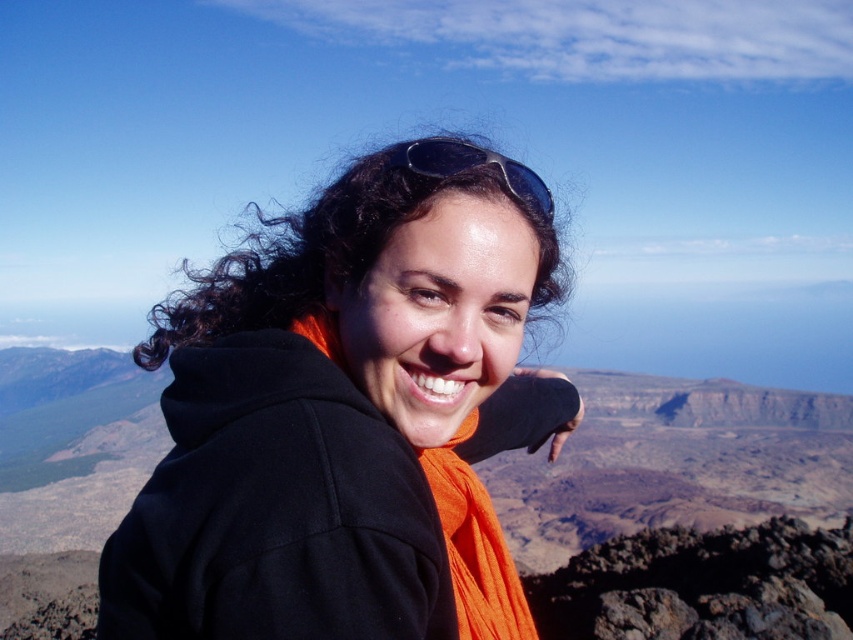
Question: Among these objects, which one is nearest to the camera?

Choices:
 (A) black fleece jacket at center
 (B) black plastic sunglasses at upper center

Answer: (A)

Question: Which of the following is the farthest from the observer?

Choices:
 (A) black plastic sunglasses at upper center
 (B) black fleece jacket at center

Answer: (A)

Question: Is black fleece jacket at center positioned behind black plastic sunglasses at upper center?

Choices:
 (A) yes
 (B) no

Answer: (B)

Question: Is black fleece jacket at center smaller than black plastic sunglasses at upper center?

Choices:
 (A) yes
 (B) no

Answer: (B)

Question: Does black fleece jacket at center appear on the right side of black plastic sunglasses at upper center?

Choices:
 (A) no
 (B) yes

Answer: (A)

Question: Which object appears farthest from the camera in this image?

Choices:
 (A) black fleece jacket at center
 (B) black plastic sunglasses at upper center

Answer: (B)